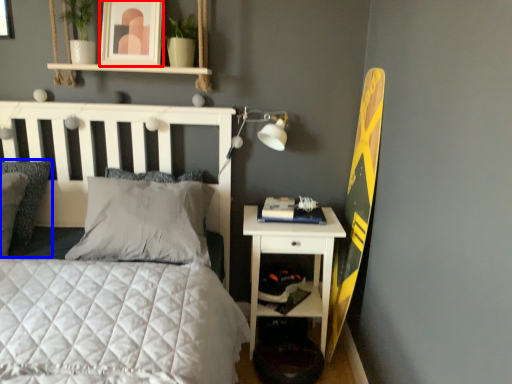
Question: Which object is closer to the camera taking this photo, picture frame (highlighted by a red box) or pillow (highlighted by a blue box)?

Choices:
 (A) picture frame
 (B) pillow

Answer: (B)